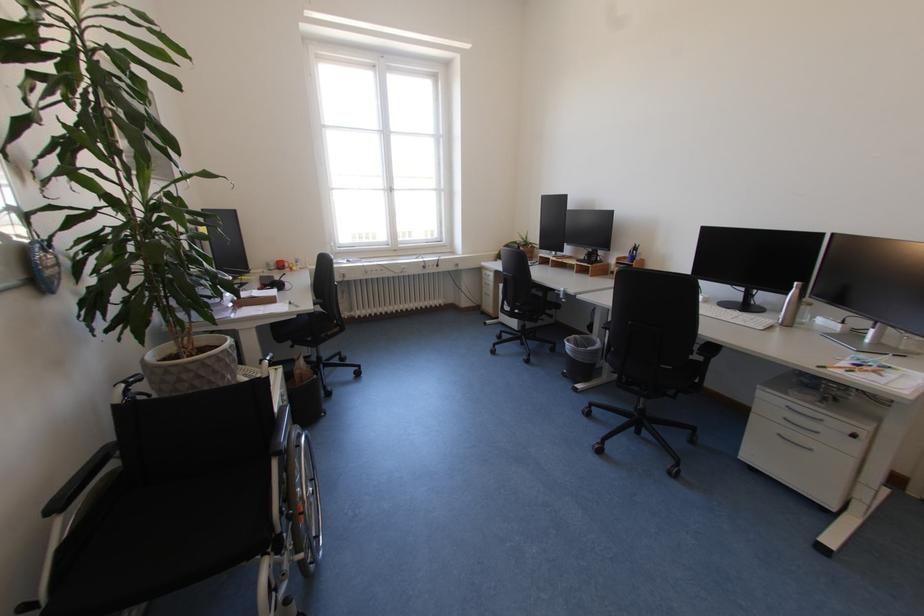
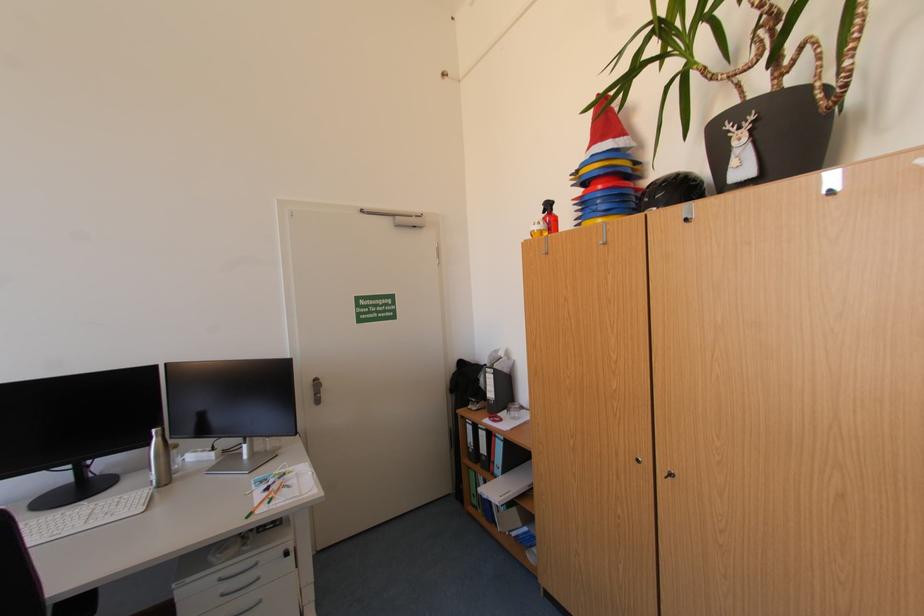
Find the pixel in the second image that matches point (804, 284) in the first image.

(161, 431)